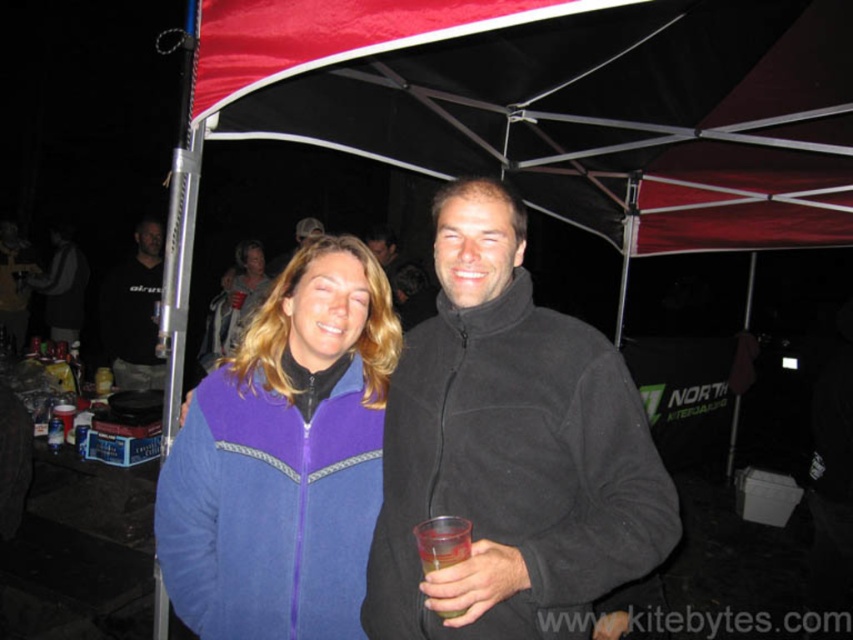
Between purple fleece jacket at center and black fleece jacket at left, which one appears on the left side from the viewer's perspective?

From the viewer's perspective, black fleece jacket at left appears more on the left side.

Does purple fleece jacket at center have a greater width compared to black fleece jacket at left?

No, purple fleece jacket at center is not wider than black fleece jacket at left.

Is point (361, 481) behind point (113, 278)?

That is False.

The height and width of the screenshot is (640, 853). What are the coordinates of `purple fleece jacket at center` in the screenshot? It's located at (283, 458).

Which of these two, black fleece jacket at center or black fleece jacket at left, stands taller?

black fleece jacket at left is taller.

Who is shorter, black fleece jacket at center or black fleece jacket at left?

With less height is black fleece jacket at center.

Image resolution: width=853 pixels, height=640 pixels. What are the coordinates of `black fleece jacket at center` in the screenshot? It's located at (509, 449).

I want to click on black fleece jacket at center, so click(x=509, y=449).

Does point (265, 282) come farther from viewer compared to point (428, 560)?

Yes, it is.

Between point (221, 333) and point (425, 573), which one is positioned behind?

The point (221, 333) is more distant.

Find the location of a particular element. The width and height of the screenshot is (853, 640). matte purple fleece jacket at upper center is located at coordinates (242, 294).

Locate an element on the screen. matte purple fleece jacket at upper center is located at coordinates (242, 294).